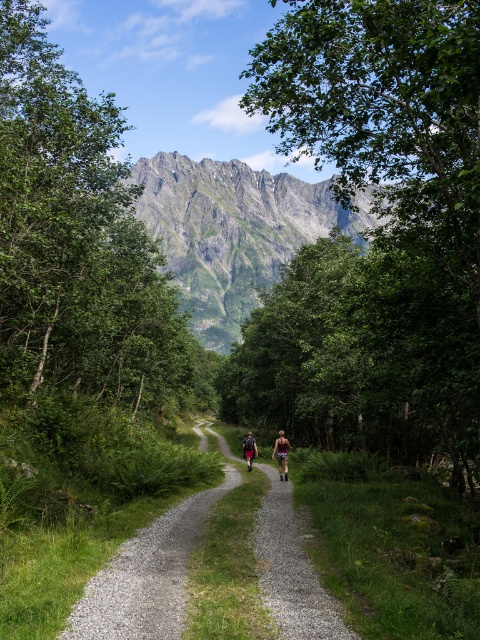
You are a hiker who wants to place your camouflage shorts at center and camouflage fabric shorts at center on the ground next to the gravel path. Which direction should you place them so they are not on the path itself?

The camouflage shorts at center is to the left of camouflage fabric shorts at center. To keep them off the path, place the camouflage shorts at center to the left side of the path and the camouflage fabric shorts at center to the right side of the path.